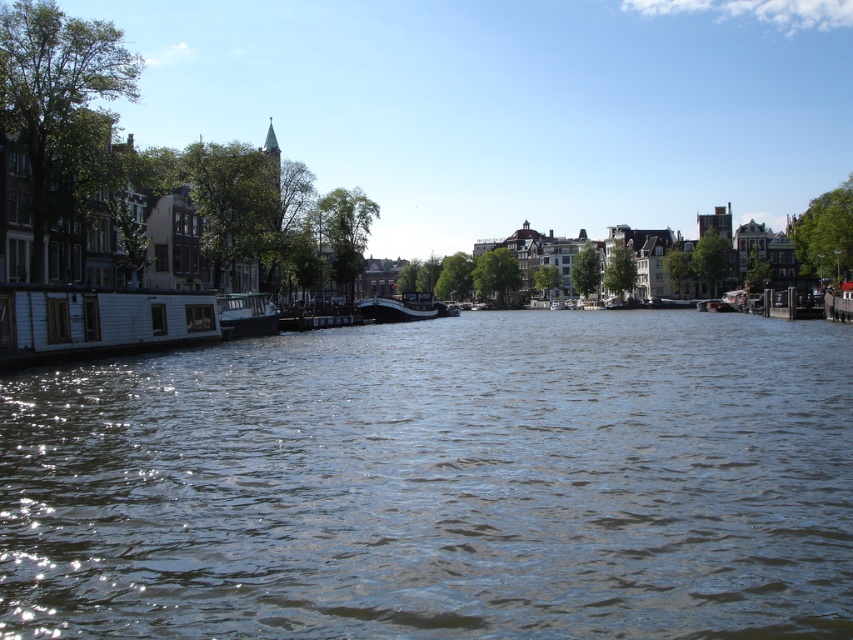
Question: Is white glossy boat at left closer to the viewer compared to white glossy boat at center?

Choices:
 (A) no
 (B) yes

Answer: (B)

Question: Does brown water at center have a larger size compared to white glossy boat at center?

Choices:
 (A) yes
 (B) no

Answer: (A)

Question: Is white glossy boat at left closer to the viewer compared to white glossy boat at center?

Choices:
 (A) yes
 (B) no

Answer: (A)

Question: Which object is farther from the camera taking this photo?

Choices:
 (A) brown water at center
 (B) white glossy boat at left

Answer: (B)

Question: Estimate the real-world distances between objects in this image. Which object is farther from the brown water at center?

Choices:
 (A) white glossy boat at left
 (B) white glossy boat at center

Answer: (B)

Question: Among these objects, which one is nearest to the camera?

Choices:
 (A) white glossy boat at center
 (B) brown water at center

Answer: (B)